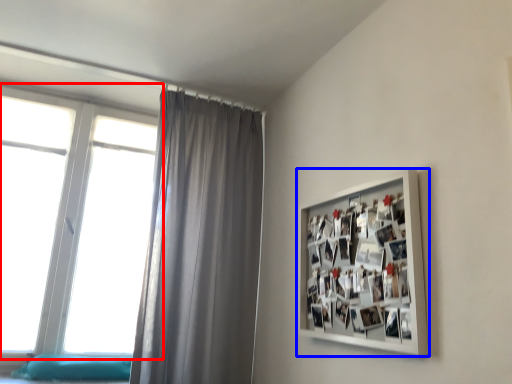
Question: Among these objects, which one is nearest to the camera, window (highlighted by a red box) or picture frame (highlighted by a blue box)?

Choices:
 (A) window
 (B) picture frame

Answer: (B)